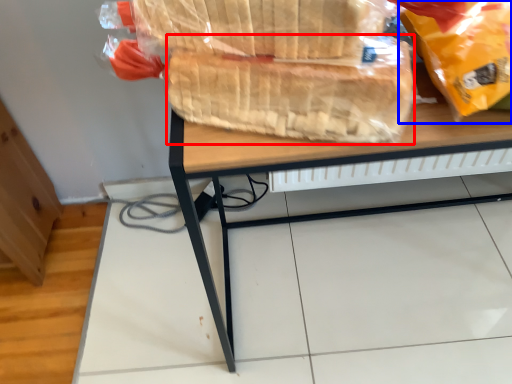
Question: Which point is further to the camera, bread (highlighted by a red box) or plastic bag (highlighted by a blue box)?

Choices:
 (A) bread
 (B) plastic bag

Answer: (A)